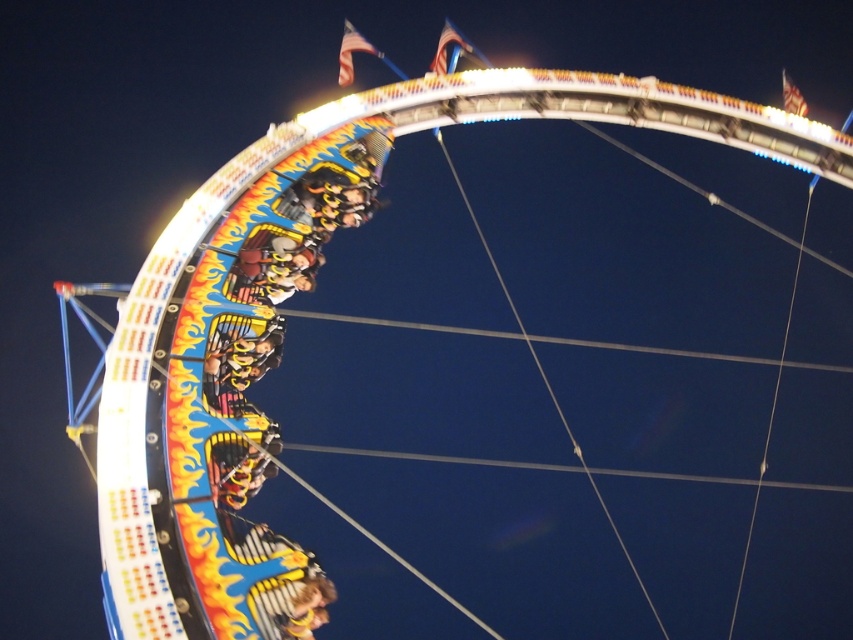
You are standing at the entrance of the roller coaster and see the point at coordinates (273, 294). Which object is this point located on?

The point at coordinates (273, 294) is located on the metallic yellow roller coaster car at center.

You are a safety inspector checking the roller coaster layout. The safety protocol requires that the roller coaster car must be positioned at the exact center of the track loop to ensure proper weight distribution. Is the metallic yellow roller coaster car at center positioned correctly according to the coordinates provided?

The metallic yellow roller coaster car at center is located at point (273,294), which may not be the exact center of the track loop. Therefore, it might not be positioned correctly according to the safety protocol requirements.